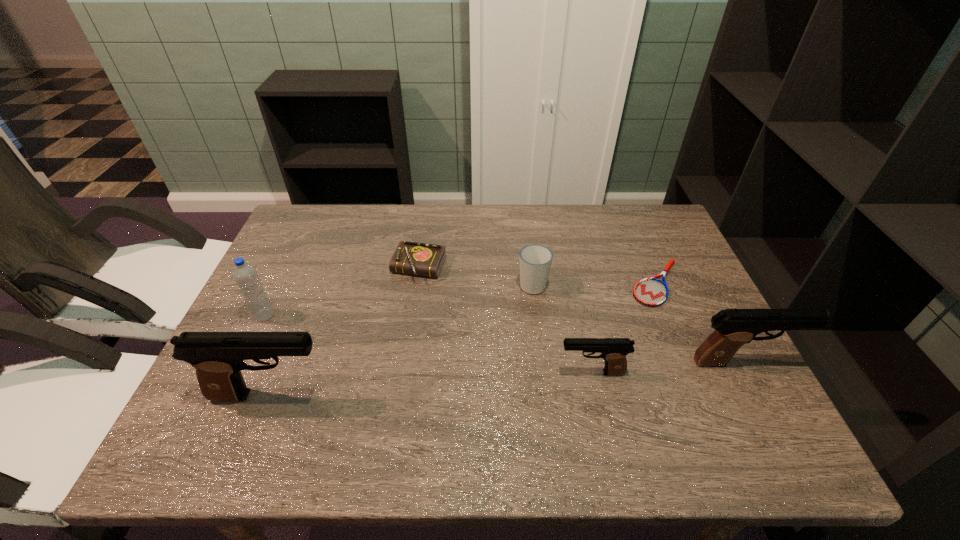
This screenshot has height=540, width=960. Find the location of `vacant region between the shortest object and the cup`. vacant region between the shortest object and the cup is located at coordinates (594, 284).

Locate an element on the screen. The image size is (960, 540). object that stands as the sixth closest to the second pistol from right to left is located at coordinates (245, 275).

This screenshot has height=540, width=960. Find the location of `object that stands as the second closest to the diary`. object that stands as the second closest to the diary is located at coordinates (245, 275).

At what (x,y) coordinates should I click in order to perform the action: click on pistol that is the third closest one to the diary. Please return your answer as a coordinate pair (x, y). This screenshot has width=960, height=540. Looking at the image, I should click on (735, 327).

Identify which pistol is located as the second nearest to the cup. Please provide its 2D coordinates. Your answer should be formatted as a tuple, i.e. [(x, y)], where the tuple contains the x and y coordinates of a point satisfying the conditions above.

[(735, 327)]

Where is `free space that satisfies the following two spatial constraints: 1. with a handle on the side of the shortest object; 2. on the right side of the cup`? Image resolution: width=960 pixels, height=540 pixels. free space that satisfies the following two spatial constraints: 1. with a handle on the side of the shortest object; 2. on the right side of the cup is located at coordinates (533, 284).